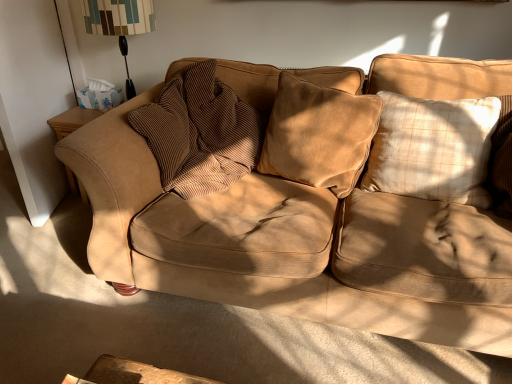
Question: From the image's perspective, is velvet brown pillow at center, which is the 2th pillow in right-to-left order, under brown corduroy pillow at center, positioned as the third pillow in right-to-left order?

Choices:
 (A) no
 (B) yes

Answer: (B)

Question: From a real-world perspective, is velvet brown pillow at center, arranged as the 2th pillow when viewed from the left, over brown corduroy pillow at center, the 1th pillow viewed from the left?

Choices:
 (A) yes
 (B) no

Answer: (A)

Question: Is brown corduroy pillow at center, positioned as the third pillow in right-to-left order, at the back of velvet brown pillow at center, arranged as the 2th pillow when viewed from the left?

Choices:
 (A) yes
 (B) no

Answer: (B)

Question: Is velvet brown pillow at center, arranged as the 2th pillow when viewed from the left, placed right next to brown corduroy pillow at center, positioned as the third pillow in right-to-left order?

Choices:
 (A) no
 (B) yes

Answer: (A)

Question: Is velvet brown pillow at center, arranged as the 2th pillow when viewed from the left, wider than brown corduroy pillow at center, positioned as the third pillow in right-to-left order?

Choices:
 (A) yes
 (B) no

Answer: (B)

Question: Considering the relative sizes of velvet brown pillow at center, arranged as the 2th pillow when viewed from the left, and brown corduroy pillow at center, positioned as the third pillow in right-to-left order, in the image provided, is velvet brown pillow at center, arranged as the 2th pillow when viewed from the left, taller than brown corduroy pillow at center, positioned as the third pillow in right-to-left order,?

Choices:
 (A) yes
 (B) no

Answer: (B)

Question: Are patterned fabric lampshade at upper left and suede couch at center beside each other?

Choices:
 (A) no
 (B) yes

Answer: (A)

Question: Does patterned fabric lampshade at upper left have a greater height compared to suede couch at center?

Choices:
 (A) no
 (B) yes

Answer: (B)

Question: Is suede couch at center inside patterned fabric lampshade at upper left?

Choices:
 (A) no
 (B) yes

Answer: (A)

Question: Is patterned fabric lampshade at upper left far from suede couch at center?

Choices:
 (A) no
 (B) yes

Answer: (B)

Question: Does patterned fabric lampshade at upper left have a smaller size compared to suede couch at center?

Choices:
 (A) yes
 (B) no

Answer: (A)

Question: Could you tell me if patterned fabric lampshade at upper left is turned towards suede couch at center?

Choices:
 (A) yes
 (B) no

Answer: (B)

Question: Does beige plaid pillow at right, placed as the third pillow when sorted from left to right, have a smaller size compared to suede couch at center?

Choices:
 (A) no
 (B) yes

Answer: (B)